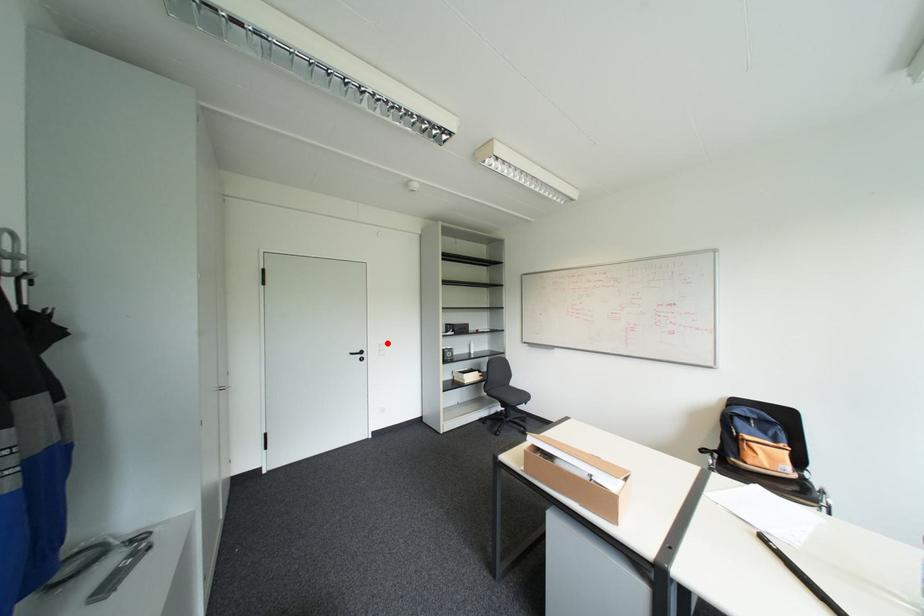
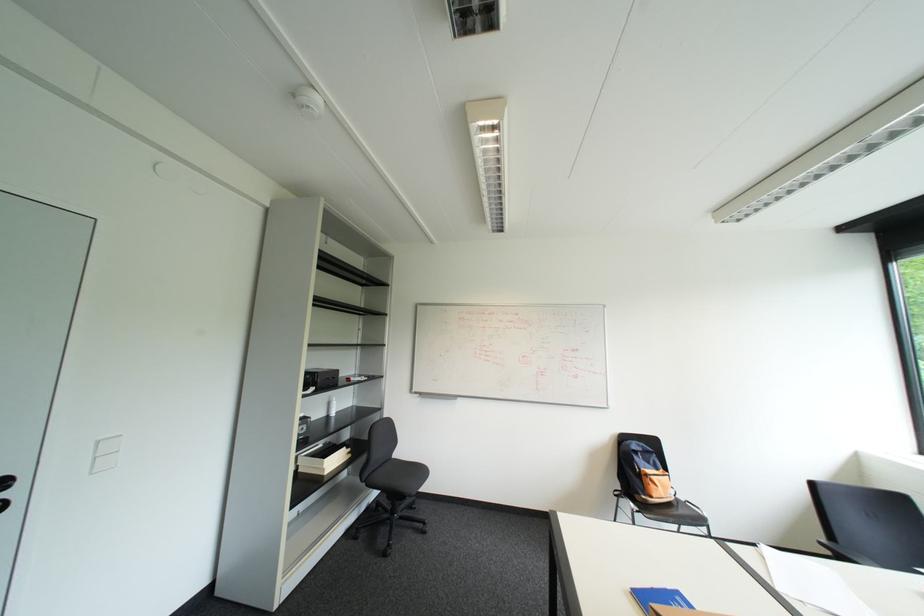
In the second image, find the point that corresponds to the highlighted location in the first image.

(107, 440)